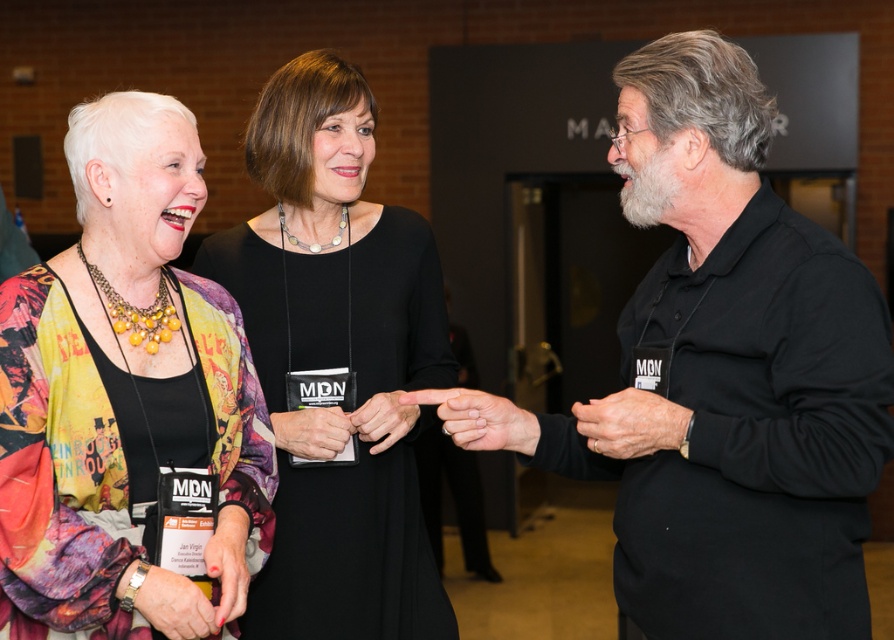
Question: Can you confirm if black matte shirt at center is wider than printed silk kimono at left?

Choices:
 (A) yes
 (B) no

Answer: (A)

Question: Can you confirm if black matte shirt at center is thinner than printed silk kimono at left?

Choices:
 (A) no
 (B) yes

Answer: (A)

Question: Can you confirm if black matte shirt at center is wider than printed silk kimono at left?

Choices:
 (A) yes
 (B) no

Answer: (A)

Question: Which of these objects is positioned farthest from the black fabric dress at center?

Choices:
 (A) printed silk kimono at left
 (B) black matte shirt at center

Answer: (B)

Question: Which point is farther to the camera?

Choices:
 (A) (137, 490)
 (B) (249, 596)
 (C) (609, 403)

Answer: (B)

Question: Which point is farther from the camera taking this photo?

Choices:
 (A) (726, 362)
 (B) (252, 344)
 (C) (263, 436)

Answer: (B)